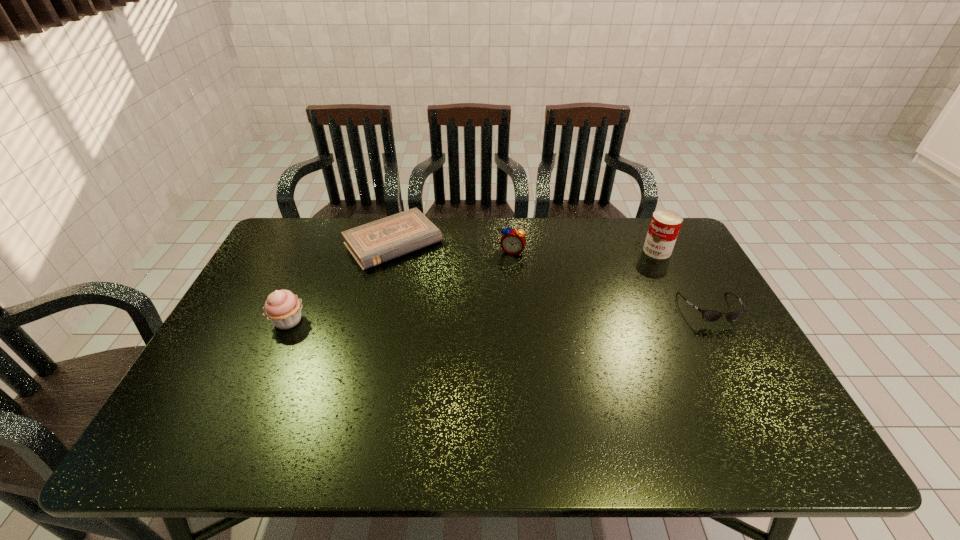
Find the location of a particular element. Image resolution: width=960 pixels, height=540 pixels. vacant spot on the desktop that is between the leftmost object and the sunglasses and is positioned on the front label of the tallest object is located at coordinates (563, 313).

Image resolution: width=960 pixels, height=540 pixels. In order to click on vacant space on the desktop that is between the leftmost object and the fourth tallest object and is positioned on the front-facing side of the alarm clock in this screenshot , I will do `click(492, 315)`.

Image resolution: width=960 pixels, height=540 pixels. I want to click on free space on the desktop that is between the cupcake and the second shortest object and is positioned on the spine side of the Bible, so click(x=456, y=316).